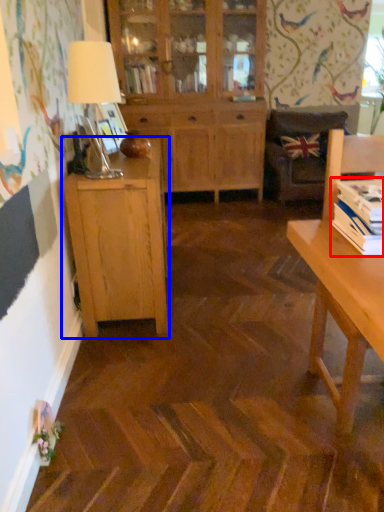
Question: Which object appears closest to the camera in this image, book (highlighted by a red box) or cabinetry (highlighted by a blue box)?

Choices:
 (A) book
 (B) cabinetry

Answer: (A)